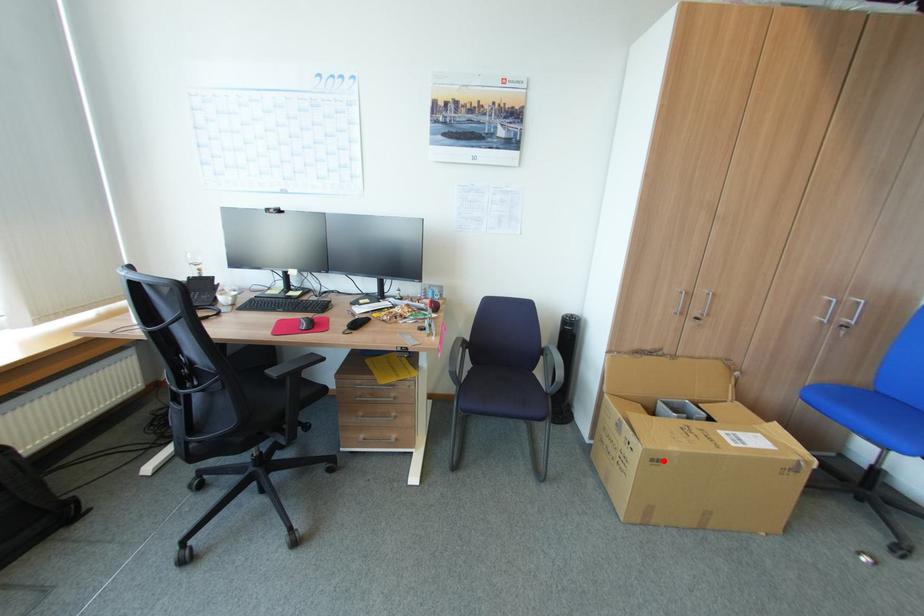
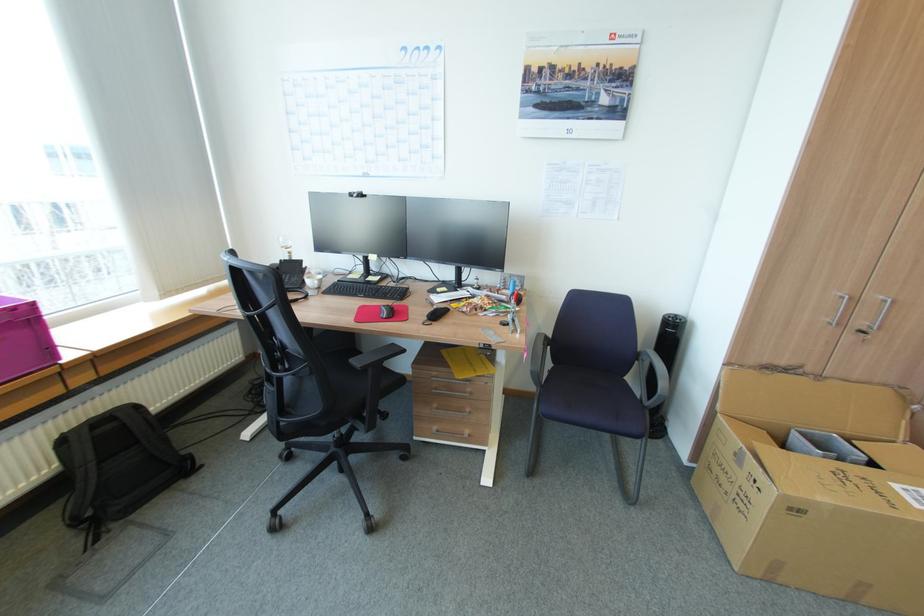
Question: I am providing you with two images of the same scene from different viewpoints. A red point is marked on the first image. At the location where the point appears in image 1, is it still visible in image 2?

Choices:
 (A) Yes
 (B) No

Answer: (A)